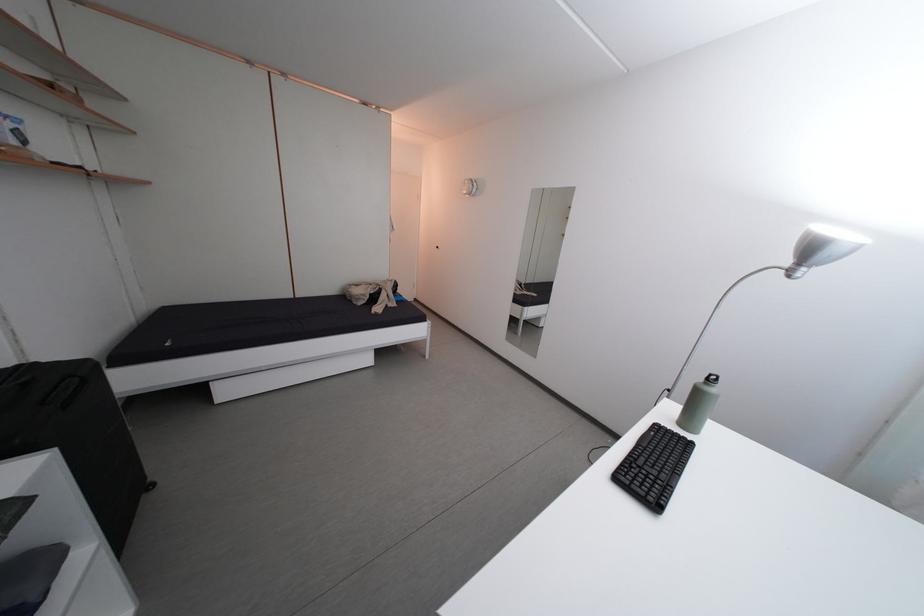
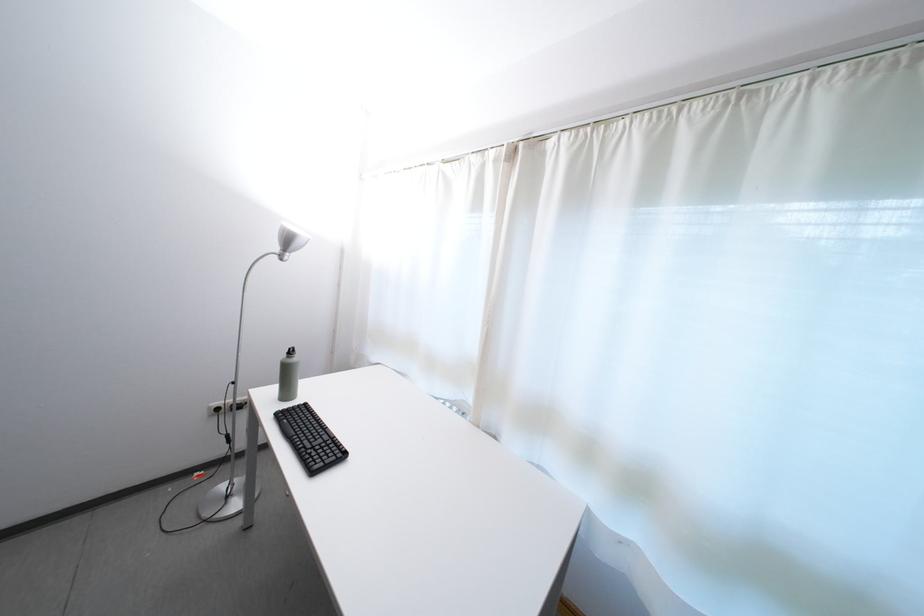
In the second image, find the point that corresponds to [797,268] in the first image.

(286, 254)